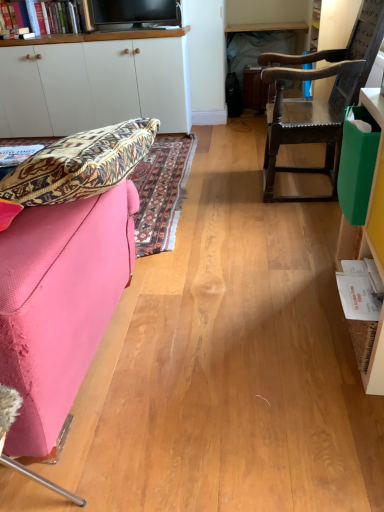
Where is `free location to the right of pink fabric couch at left`? The image size is (384, 512). free location to the right of pink fabric couch at left is located at coordinates (237, 327).